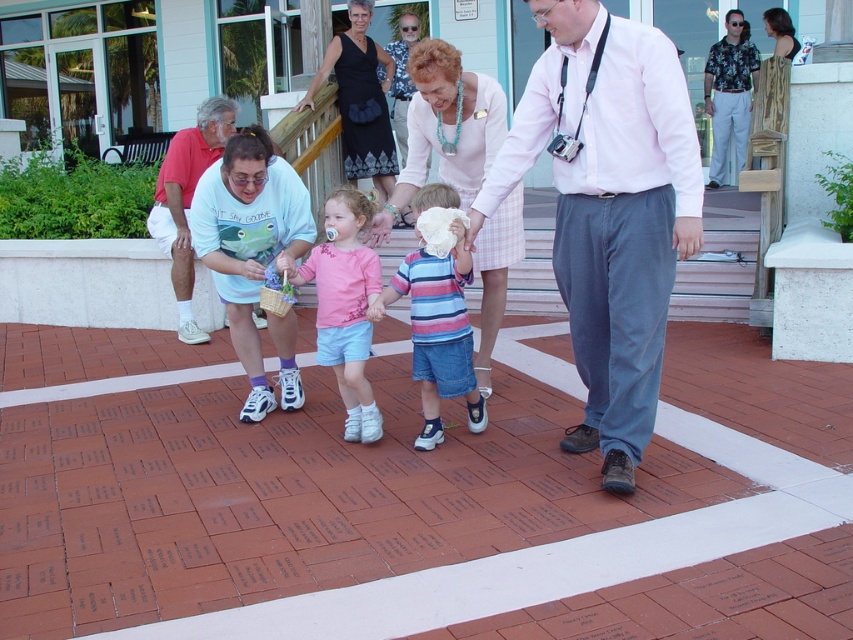
You are standing at the entrance of the building and want to locate the child wearing the pink shirt at center. According to the coordinates provided, in which direction should you look relative to your position?

The pink shirt at center is located at point coordinates, so you should look towards the center of the image to find the child wearing the pink shirt at center.